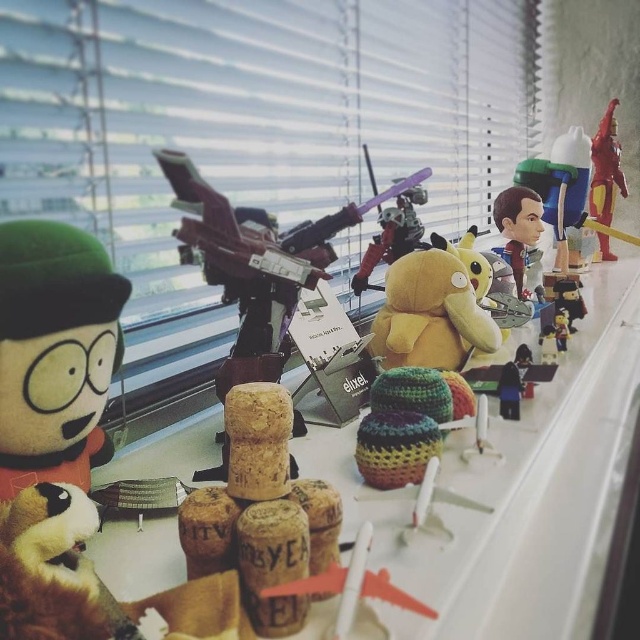
Question: Which is nearer to the fluffy green plush at left?

Choices:
 (A) smooth plastic toy at center
 (B) cork at center

Answer: (B)

Question: Which point is farther to the camera?

Choices:
 (A) (81, 294)
 (B) (609, 128)

Answer: (B)

Question: Which is nearer to the smooth plastic bobblehead at center?

Choices:
 (A) yellow plush at center
 (B) brown cork stoppers at center
 (C) metallic purple robot at center
 (D) smooth plastic toy at center

Answer: (D)

Question: Is fluffy green plush at left above smooth plastic bobblehead at center?

Choices:
 (A) yes
 (B) no

Answer: (B)

Question: Can you confirm if fluffy green plush at left is bigger than metallic purple robot at center?

Choices:
 (A) no
 (B) yes

Answer: (A)

Question: Does brown cork stoppers at center appear on the right side of fluffy green plush at left?

Choices:
 (A) no
 (B) yes

Answer: (B)